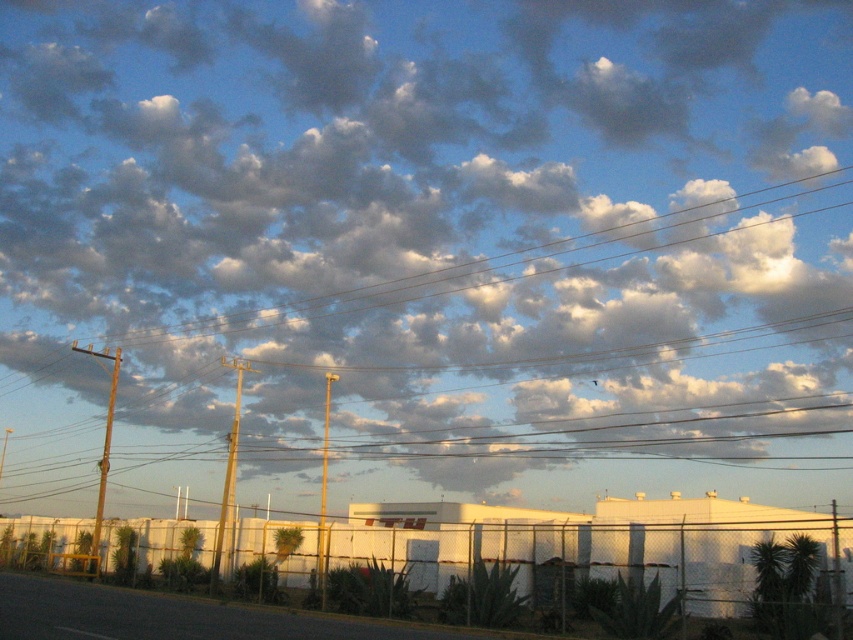
You are a bird flying over the scene and want to land on the metallic pole that is closer to the fence. Which metallic pole should you choose between the metallic pole at left and the metallic pole at center?

The metallic pole at left is positioned over the metallic pole at center, meaning it is closer to the fence. Therefore, you should choose the metallic pole at left.

You are standing in the scene and want to walk from the point at coordinates point (103, 461) to the point at coordinates point (325, 545). Which direction should you face to move towards the point that is closer to you?

You should face away from the point at coordinates point (103, 461) because it is closer to you than the point at coordinates point (325, 545), so moving away from it would take you toward the farther point.

You are a painter who wants to paint both the smooth wood pole at center and the metallic pole at left. If you have brushes of different sizes, which brush size would you choose for each pole to ensure the brush width matches the pole width?

For the smooth wood pole at center, choose a smaller brush since its width is less than the metallic pole at left, which requires a larger brush.